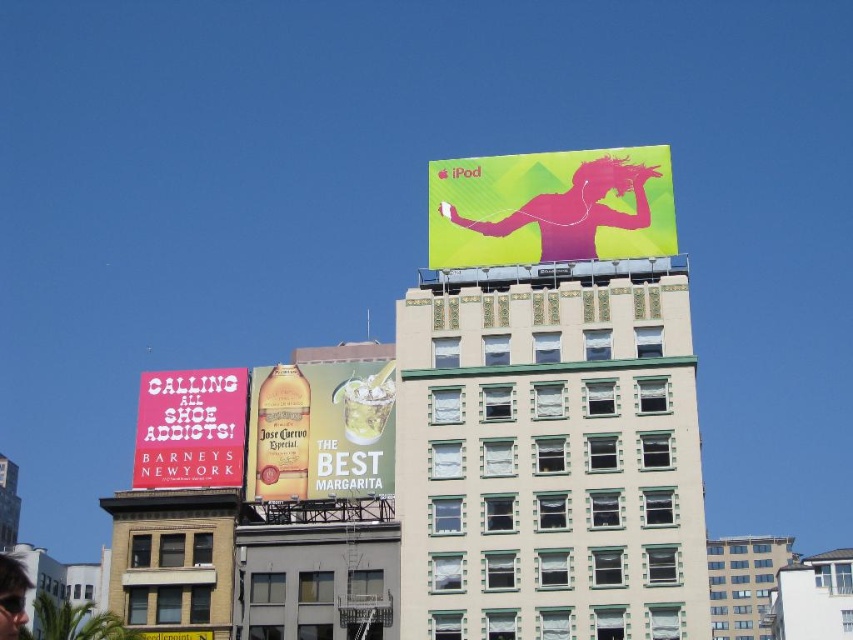
Is point (190, 630) behind point (782, 621)?

No, it is not.

The height and width of the screenshot is (640, 853). Describe the element at coordinates (173, 561) in the screenshot. I see `beige brick building at lower left` at that location.

Is point (155, 621) less distant than point (782, 580)?

Yes.

Image resolution: width=853 pixels, height=640 pixels. Identify the location of beige brick building at lower left. (173, 561).

Measure the distance between point [521,180] and camera.

Point [521,180] and camera are 62.21 meters apart.

Between point (662, 227) and point (780, 548), which one is positioned in front?

Point (662, 227) is more forward.

Which is in front, point (445, 204) or point (706, 561)?

Point (706, 561)

Locate an element on the screen. pink matte ipod at upper center is located at coordinates (550, 208).

Can you confirm if matte gold bottle at center is shorter than white concrete building at center?

Yes, matte gold bottle at center is shorter than white concrete building at center.

Is point (250, 460) positioned in front of point (782, 552)?

Yes, point (250, 460) is in front of point (782, 552).

Locate an element on the screen. matte gold bottle at center is located at coordinates (320, 429).